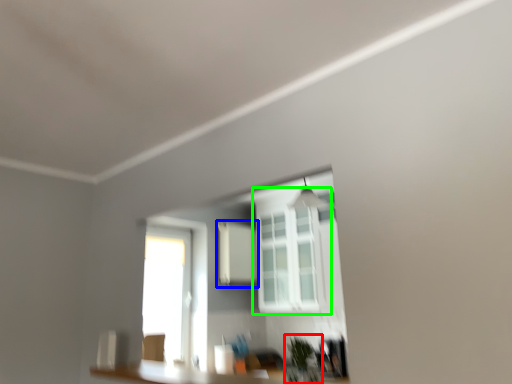
Question: Based on their relative distances, which object is nearer to plant (highlighted by a red box)? Choose from medicine cabinet (highlighted by a blue box) and window (highlighted by a green box).

Choices:
 (A) medicine cabinet
 (B) window

Answer: (B)